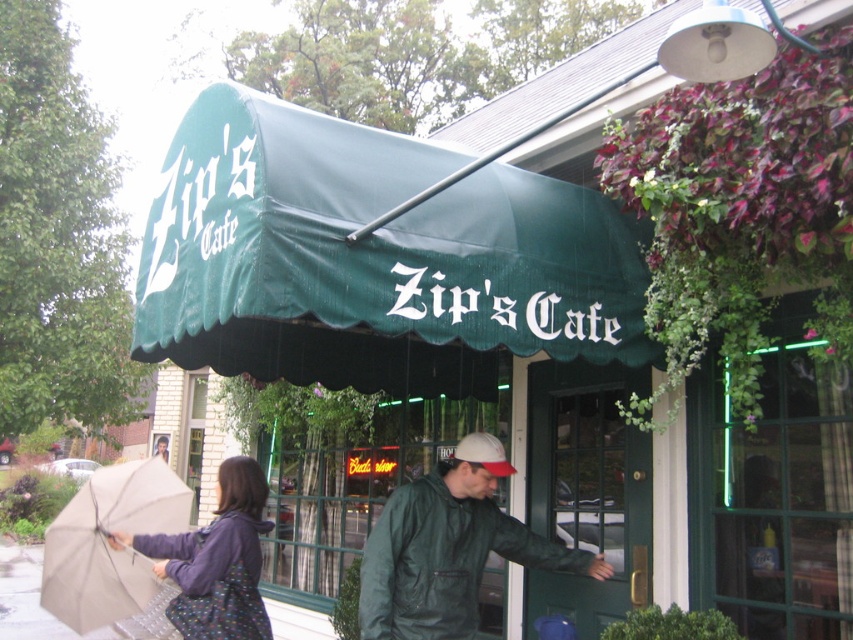
Between beige fabric umbrella at lower left and gray concrete pavement at lower left, which one appears on the right side from the viewer's perspective?

From the viewer's perspective, beige fabric umbrella at lower left appears more on the right side.

Is beige fabric umbrella at lower left above gray concrete pavement at lower left?

Correct, beige fabric umbrella at lower left is located above gray concrete pavement at lower left.

What do you see at coordinates (107, 544) in the screenshot? I see `beige fabric umbrella at lower left` at bounding box center [107, 544].

At what (x,y) coordinates should I click in order to perform the action: click on beige fabric umbrella at lower left. Please return your answer as a coordinate pair (x, y). This screenshot has height=640, width=853. Looking at the image, I should click on (107, 544).

The image size is (853, 640). What do you see at coordinates (215, 561) in the screenshot?
I see `matte purple jacket at lower left` at bounding box center [215, 561].

Does matte purple jacket at lower left have a greater width compared to gray concrete pavement at lower left?

No.

What do you see at coordinates (215, 561) in the screenshot?
I see `matte purple jacket at lower left` at bounding box center [215, 561].

Image resolution: width=853 pixels, height=640 pixels. What are the coordinates of `matte purple jacket at lower left` in the screenshot? It's located at (215, 561).

Which is behind, point (228, 92) or point (431, 554)?

Positioned behind is point (431, 554).

Find the location of a particular element. The image size is (853, 640). green fabric awning at upper center is located at coordinates (370, 259).

In the scene shown: Measure the distance between green fabric awning at upper center and camera.

green fabric awning at upper center and camera are 2.74 meters apart.

Identify the location of green fabric awning at upper center. The width and height of the screenshot is (853, 640). (370, 259).